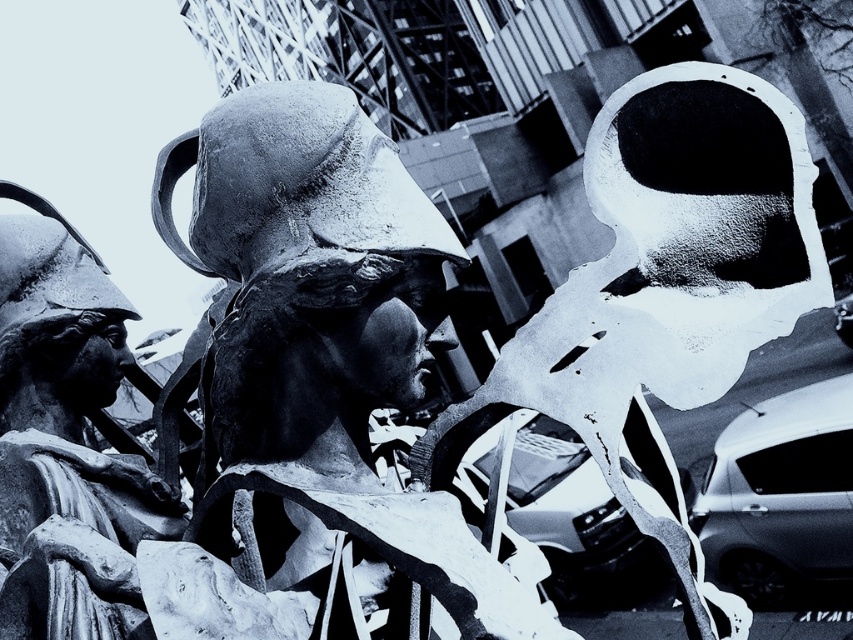
You are an art student analyzing this sculpture. You notice two points marked on the image at coordinates point (738,70) and point (9,554). Based on their positions, which point is closer to the viewer?

Point (738,70) is closer to the viewer than point (9,554) because it is positioned nearer in the scene.

Based on the scene described, where is the smooth white mask at center located in relation to the smooth stone statue at center?

The smooth white mask at center is to the right of the smooth stone statue at center.

In the scene shown: Looking at the black and white photograph of the sculpture, you notice two central elements. The smooth stone statue at center and the smooth white mask at center. Which of these two objects is wider?

The smooth stone statue at center is wider than the smooth white mask at center.